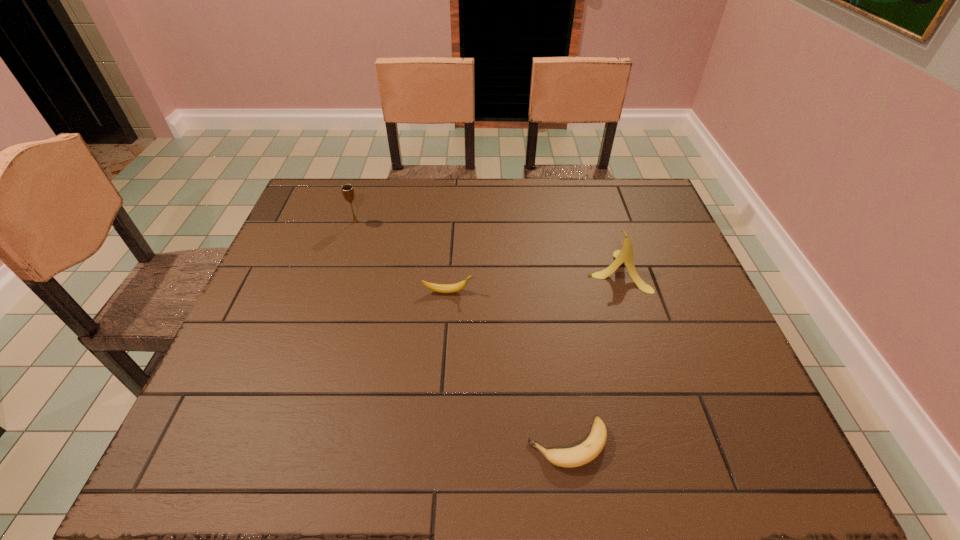
Find the location of a particular element. The image size is (960, 540). object that stands as the third closest to the second shortest object is located at coordinates (577, 456).

Locate an element on the screen. This screenshot has height=540, width=960. object that is the third closest one to the leftmost banana is located at coordinates tap(577, 456).

Identify the location of banana that stands as the closest to the tallest banana. The image size is (960, 540). (441, 288).

The width and height of the screenshot is (960, 540). I want to click on the second closest banana to the leftmost banana, so click(x=577, y=456).

Find the location of a particular element. This screenshot has width=960, height=540. free space that satisfies the following two spatial constraints: 1. on the front side of the leftmost object; 2. on the right side of the tallest banana is located at coordinates (340, 271).

You are a GUI agent. You are given a task and a screenshot of the screen. Output one action in this format:
    pyautogui.click(x=<x>, y=<y>)
    Task: Click on the vacant space that satisfies the following two spatial constraints: 1. at the stem of the nearest object; 2. on the left side of the third tallest object
    
    Given the screenshot: What is the action you would take?
    pyautogui.click(x=437, y=444)

At what (x,y) coordinates should I click in order to perform the action: click on vacant space that satisfies the following two spatial constraints: 1. at the stem of the third tallest object; 2. on the right side of the second banana from right to left. Please return your answer as a coordinate pair (x, y). Looking at the image, I should click on (437, 444).

In order to click on blank space that satisfies the following two spatial constraints: 1. at the stem of the third tallest object; 2. on the left side of the second object from right to left in this screenshot , I will do `click(437, 444)`.

Identify the location of vacant space that satisfies the following two spatial constraints: 1. on the back side of the second object from right to left; 2. at the stem of the second object from left to right. (x=546, y=292).

This screenshot has height=540, width=960. Find the location of `free spot that satisfies the following two spatial constraints: 1. at the stem of the third tallest object; 2. on the back side of the shortest banana`. free spot that satisfies the following two spatial constraints: 1. at the stem of the third tallest object; 2. on the back side of the shortest banana is located at coordinates (437, 444).